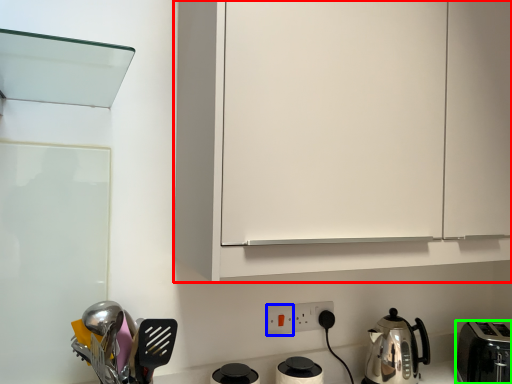
Question: Which object is the farthest from cabinetry (highlighted by a red box)? Choose among these: electric outlet (highlighted by a blue box) or toaster (highlighted by a green box).

Choices:
 (A) electric outlet
 (B) toaster

Answer: (B)